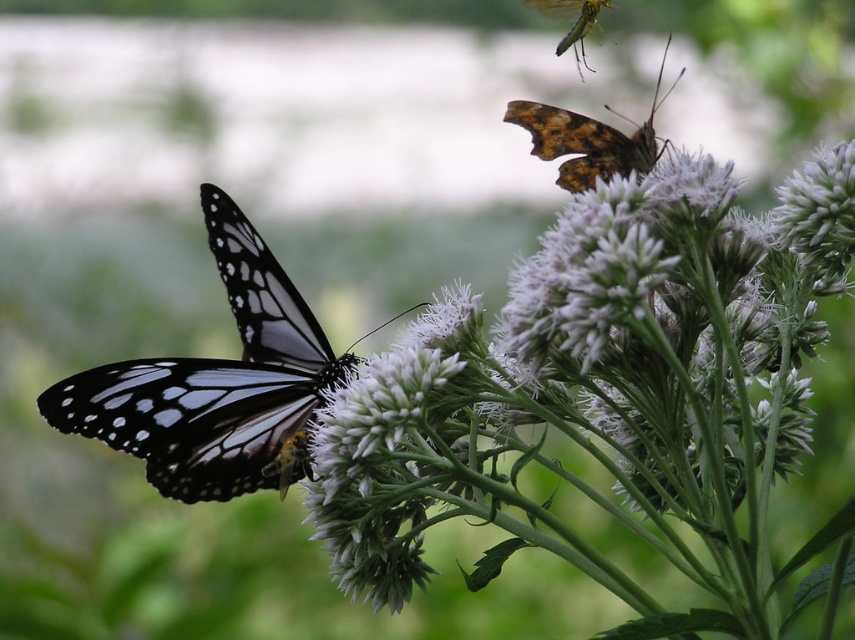
Question: Which object is farther from the camera taking this photo?

Choices:
 (A) translucent yellow-green dragonfly at upper right
 (B) brown textured butterfly at upper right
 (C) white fluffy flower at upper center
 (D) matte black and white butterfly at center

Answer: (A)

Question: Which object appears closest to the camera in this image?

Choices:
 (A) brown textured butterfly at upper right
 (B) white fluffy flower at upper center

Answer: (B)

Question: Does matte black and white butterfly at center lie in front of brown textured butterfly at upper right?

Choices:
 (A) yes
 (B) no

Answer: (B)

Question: Which of the following is the closest to the observer?

Choices:
 (A) (759, 464)
 (B) (600, 179)
 (C) (269, 486)

Answer: (A)

Question: Can you confirm if brown textured butterfly at upper right is wider than translucent yellow-green dragonfly at upper right?

Choices:
 (A) yes
 (B) no

Answer: (A)

Question: Considering the relative positions of matte black and white butterfly at center and translucent yellow-green dragonfly at upper right in the image provided, where is matte black and white butterfly at center located with respect to translucent yellow-green dragonfly at upper right?

Choices:
 (A) above
 (B) below

Answer: (B)